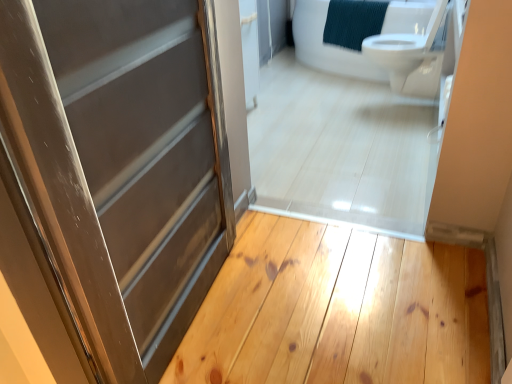
Question: Would you say white glossy toilet at upper right contains matte gray door at center?

Choices:
 (A) no
 (B) yes

Answer: (A)

Question: Considering the relative positions of white glossy toilet at upper right and matte gray door at center in the image provided, is white glossy toilet at upper right to the left of matte gray door at center from the viewer's perspective?

Choices:
 (A) no
 (B) yes

Answer: (A)

Question: Can you confirm if white glossy toilet at upper right is shorter than matte gray door at center?

Choices:
 (A) yes
 (B) no

Answer: (A)

Question: Would you say white glossy toilet at upper right is a long distance from matte gray door at center?

Choices:
 (A) no
 (B) yes

Answer: (B)

Question: From a real-world perspective, is white glossy toilet at upper right positioned over matte gray door at center based on gravity?

Choices:
 (A) yes
 (B) no

Answer: (B)

Question: Is white glossy toilet at upper right not within matte gray door at center?

Choices:
 (A) no
 (B) yes

Answer: (B)

Question: Does white glossy toilet at upper right have a lesser height compared to light brown wood plank at center?

Choices:
 (A) no
 (B) yes

Answer: (A)

Question: Is white glossy toilet at upper right oriented away from light brown wood plank at center?

Choices:
 (A) yes
 (B) no

Answer: (B)

Question: Considering the relative positions of white glossy toilet at upper right and light brown wood plank at center in the image provided, is white glossy toilet at upper right to the right of light brown wood plank at center from the viewer's perspective?

Choices:
 (A) yes
 (B) no

Answer: (A)

Question: From a real-world perspective, is white glossy toilet at upper right under light brown wood plank at center?

Choices:
 (A) no
 (B) yes

Answer: (A)

Question: From the image's perspective, is white glossy toilet at upper right beneath light brown wood plank at center?

Choices:
 (A) no
 (B) yes

Answer: (A)

Question: Can you see white glossy toilet at upper right touching light brown wood plank at center?

Choices:
 (A) no
 (B) yes

Answer: (A)

Question: Can light brown wood plank at center be found inside matte gray door at center?

Choices:
 (A) yes
 (B) no

Answer: (B)